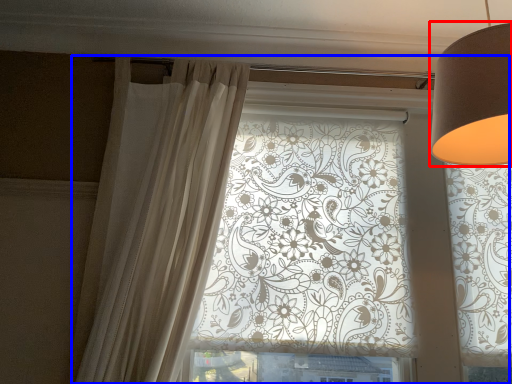
Question: Among these objects, which one is nearest to the camera, lamp (highlighted by a red box) or window (highlighted by a blue box)?

Choices:
 (A) lamp
 (B) window

Answer: (A)